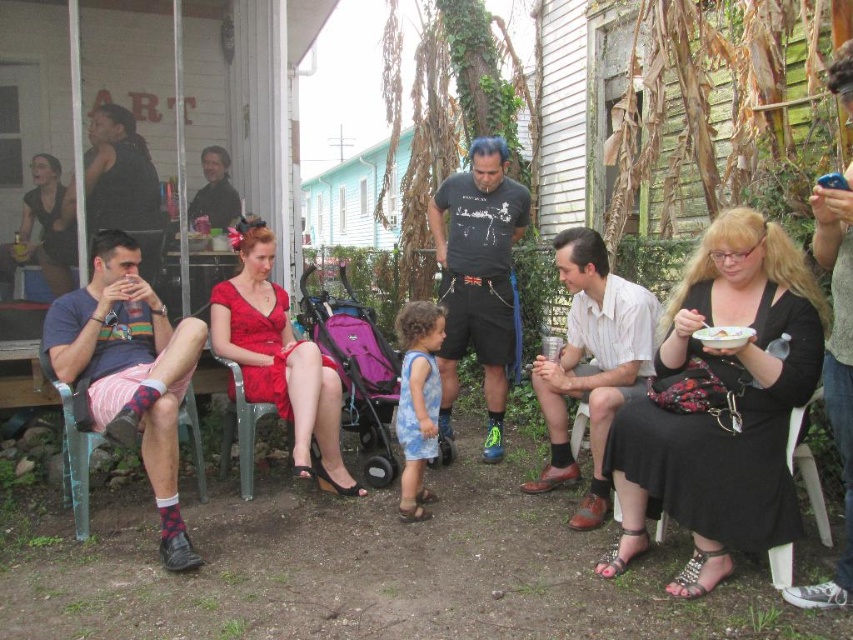
In the scene shown: Is white striped shirt at center closer to the viewer compared to metallic green chair at left?

No, white striped shirt at center is behind metallic green chair at left.

Between point (596, 477) and point (73, 496), which one is positioned in front?

Point (73, 496)

The image size is (853, 640). Identify the location of white striped shirt at center. (590, 364).

Is point (444, 292) in front of point (245, 413)?

No.

Which is behind, point (445, 186) or point (251, 442)?

The point (445, 186) is more distant.

The width and height of the screenshot is (853, 640). What are the coordinates of `matte black t-shirt at center` in the screenshot? It's located at (479, 276).

Does white striped shirt at center appear over white plastic chair at lower right?

Yes.

From the picture: Is the position of white striped shirt at center less distant than that of white plastic chair at lower right?

No, white striped shirt at center is further to the viewer.

Does point (618, 362) lie in front of point (817, 476)?

No.

What are the coordinates of `white striped shirt at center` in the screenshot? It's located at (590, 364).